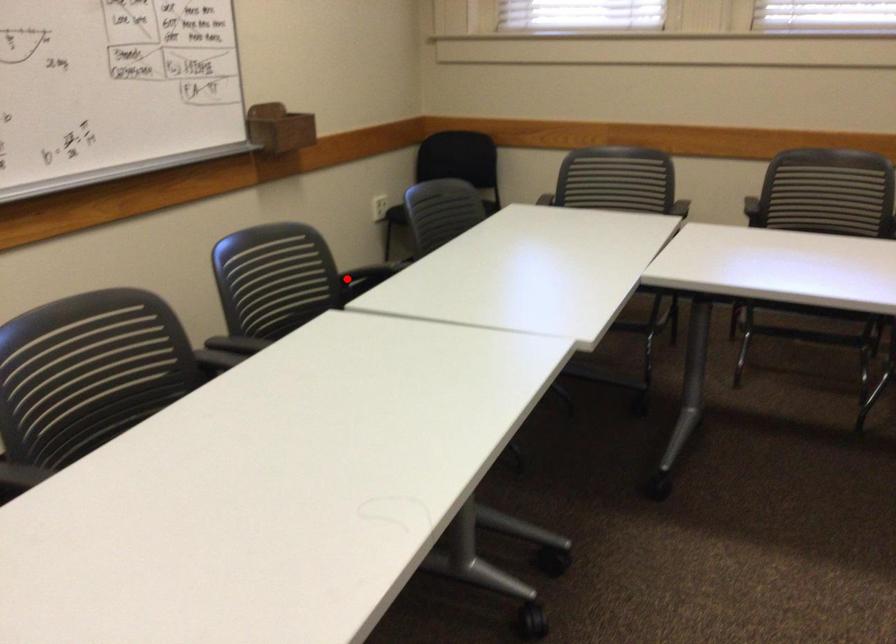
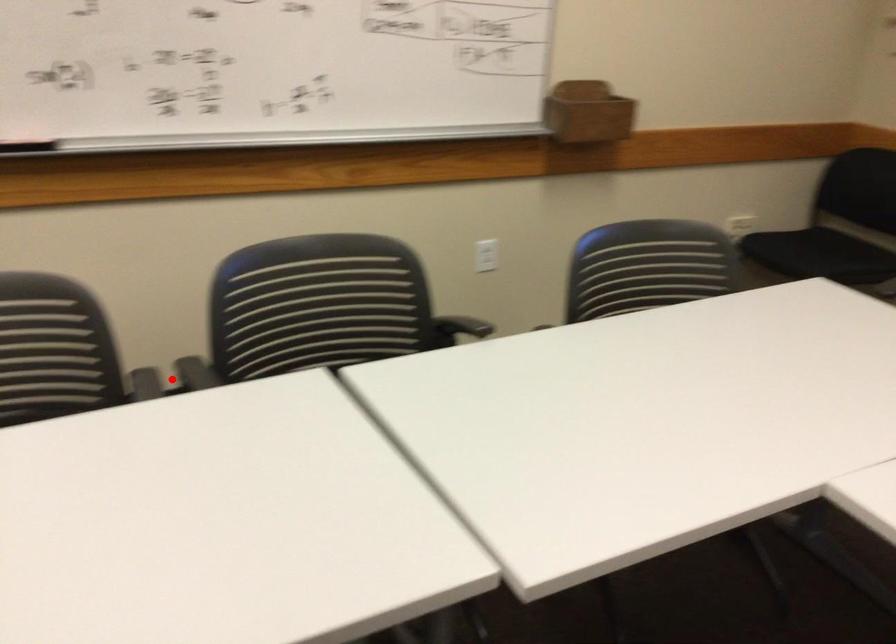
From the picture: I am providing you with two images of the same scene from different viewpoints. A red point is marked on the first image and another point is marked on the second image. Are the points marked in image1 and image2 representing the same 3D position?

No